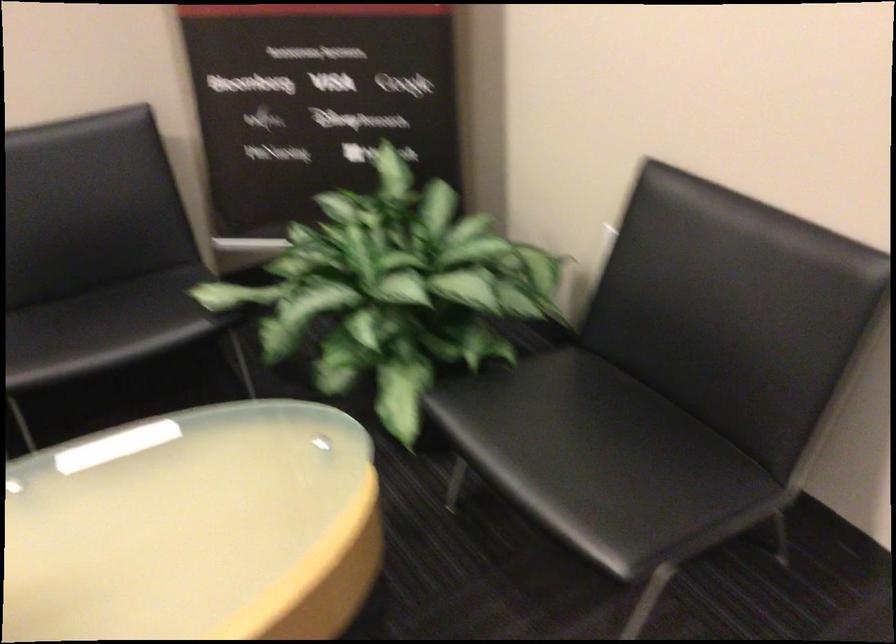
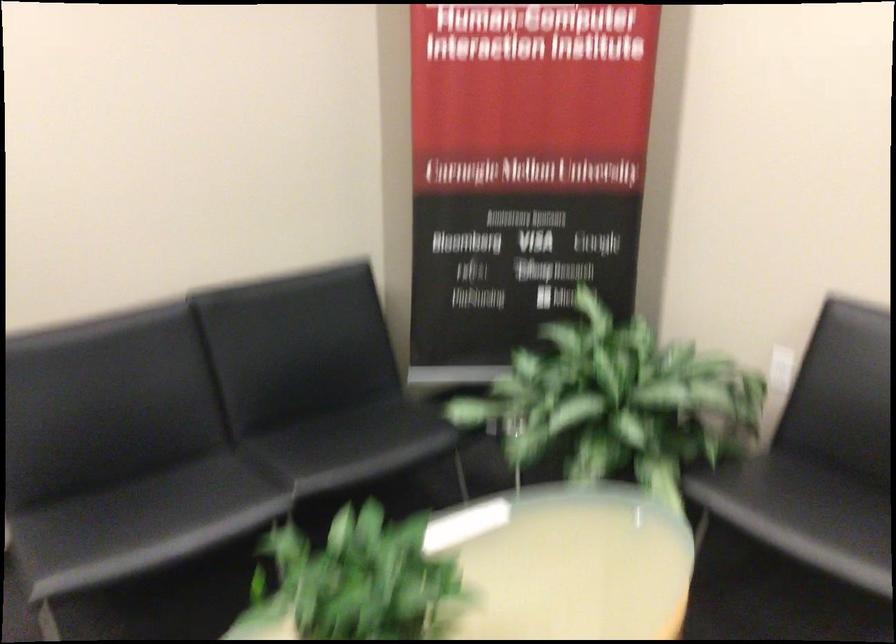
Question: The images are taken continuously from a first-person perspective. In which direction is your viewpoint rotating?

Choices:
 (A) Left
 (B) Right
 (C) Up
 (D) Down

Answer: (C)